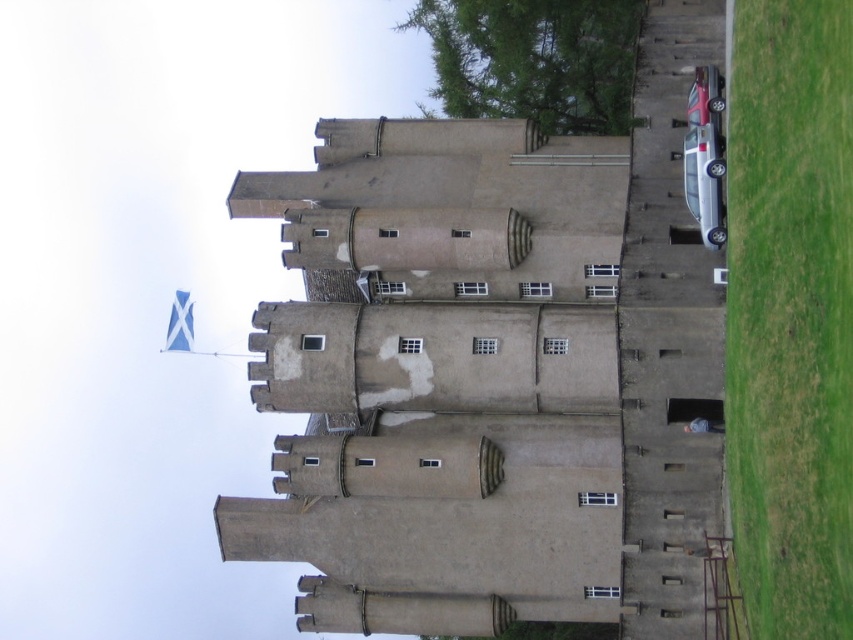
You are standing in front of the historic stone castle and want to take a photo of both the green grass at lower right and the metallic red car at upper right. Which object is nearer to you when you focus your camera?

The green grass at lower right is closer to the viewer than the metallic red car at upper right.

Looking at this image, you are a visitor arriving at the castle and see the green grass at lower right and the silver metallic car at right. Which object is closer to the castle entrance?

The green grass at lower right is positioned under the silver metallic car at right, so the silver metallic car at right is closer to the castle entrance.

You are a tour guide explaining the castle grounds to visitors. You point out the silver metallic car at right and the metallic red car at upper right parked nearby. Which car is shorter in height?

The silver metallic car at right is shorter than the metallic red car at upper right.